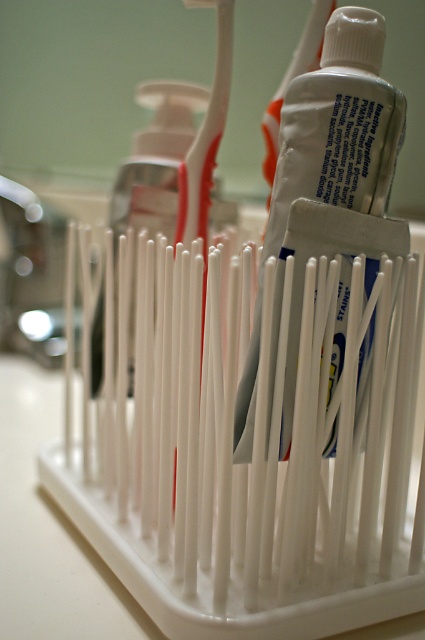
Question: Does white glossy tube of toothpaste at center appear under white plastic toothbrush at center?

Choices:
 (A) no
 (B) yes

Answer: (B)

Question: Is white plastic toothbrush at center below white plastic toothbrush at upper center?

Choices:
 (A) yes
 (B) no

Answer: (A)

Question: Does white plastic toothbrush at center appear on the right side of white plastic toothbrush at upper center?

Choices:
 (A) yes
 (B) no

Answer: (B)

Question: Which point is closer to the camera?

Choices:
 (A) white plastic toothbrush at center
 (B) white glossy tube of toothpaste at center
 (C) white plastic toothbrush at upper center

Answer: (B)

Question: Which of these objects is positioned farthest from the white glossy tube of toothpaste at center?

Choices:
 (A) white plastic toothbrush at upper center
 (B) white plastic toothbrush at center

Answer: (B)

Question: Which point is closer to the camera taking this photo?

Choices:
 (A) (308, 64)
 (B) (190, 0)

Answer: (B)